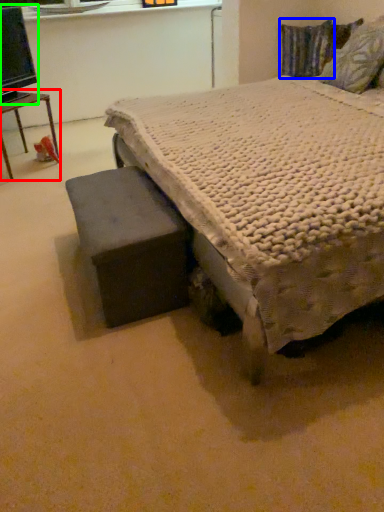
Question: Based on their relative distances, which object is nearer to table (highlighted by a red box)? Choose from pillow (highlighted by a blue box) and computer monitor (highlighted by a green box).

Choices:
 (A) pillow
 (B) computer monitor

Answer: (B)